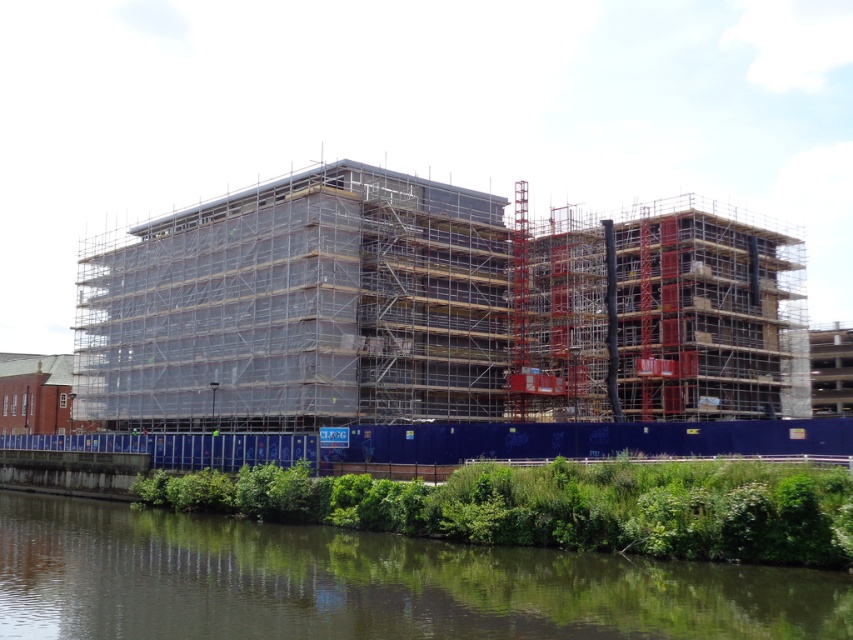
Is point (263, 262) positioned in front of point (126, 627)?

No.

Is clear plastic scaffolding at center wider than green leafy vegetation at lower center?

Indeed, clear plastic scaffolding at center has a greater width compared to green leafy vegetation at lower center.

Does point (132, 314) come behind point (343, 552)?

Yes, point (132, 314) is behind point (343, 552).

This screenshot has height=640, width=853. I want to click on clear plastic scaffolding at center, so click(x=434, y=310).